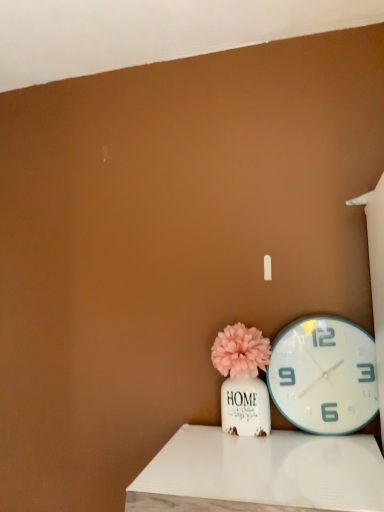
Question: Is white wood table at lower center taller or shorter than matte pink pom-pom at center?

Choices:
 (A) short
 (B) tall

Answer: (A)

Question: Which is correct: white wood table at lower center is inside matte pink pom-pom at center, or outside of it?

Choices:
 (A) outside
 (B) inside

Answer: (A)

Question: Which of these objects is positioned closest to the matte pink pom-pom at center?

Choices:
 (A) white wood table at lower center
 (B) white plastic wall clock at right

Answer: (B)

Question: Which object is the closest to the white plastic wall clock at right?

Choices:
 (A) matte pink pom-pom at center
 (B) white wood table at lower center

Answer: (A)